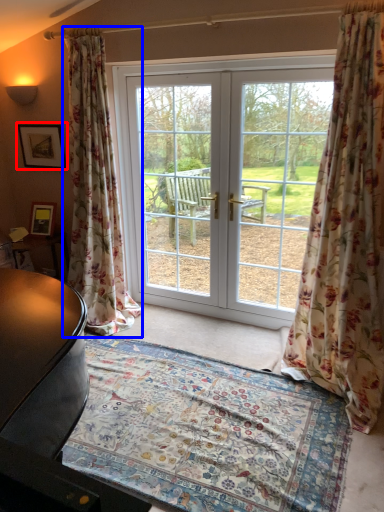
Question: Among these objects, which one is farthest to the camera, picture frame (highlighted by a red box) or curtain (highlighted by a blue box)?

Choices:
 (A) picture frame
 (B) curtain

Answer: (A)